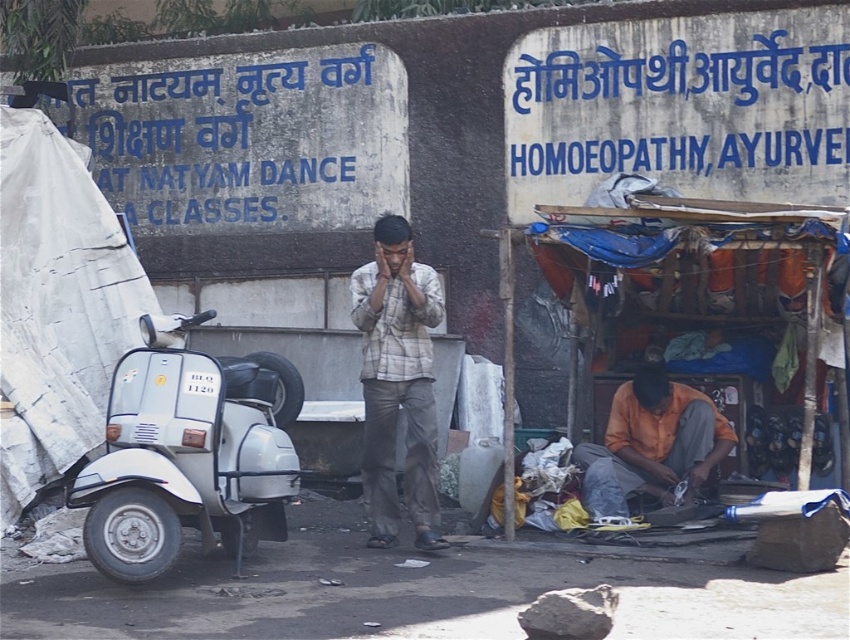
You are a delivery person trying to locate the person in the orange fabric at lower center. From your vantage point, where would you look relative to the plaid fabric shirt at center?

The orange fabric at lower center is below the plaid fabric shirt at center, so you should look downward from the plaid fabric shirt at center to find the orange fabric at lower center.

You are a delivery person needing to reach the orange fabric at lower center from the white matte scooter at left. Can your 1.8 meter long delivery cart fit through the space between them?

The distance between the white matte scooter at left and the orange fabric at lower center is 2.28 meters. Since the delivery cart is 1.8 meters long, it can easily fit through the space as there is sufficient clearance.

You are a delivery person who needs to load a package onto the white matte scooter at left. The package requires that it must be placed above the plaid fabric shirt at center to avoid blocking the rider. Can the scooter accommodate this requirement based on their heights?

The white matte scooter at left has a lesser height compared to plaid fabric shirt at center. Therefore, the package cannot be placed above the plaid fabric shirt at center since the scooter is shorter, making it impossible to position the package above the shirt.